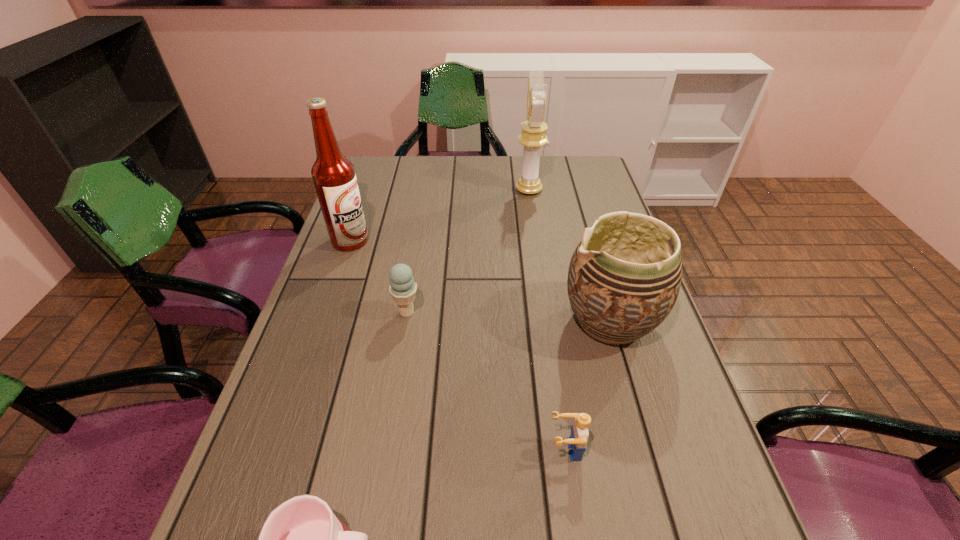
The width and height of the screenshot is (960, 540). What are the coordinates of `alcohol` in the screenshot? It's located at (334, 177).

Where is `award`? This screenshot has width=960, height=540. award is located at coordinates (533, 137).

You are a GUI agent. You are given a task and a screenshot of the screen. Output one action in this format:
    pyautogui.click(x=<x>, y=<y>)
    Task: Click on the fourth shortest object
    Image resolution: width=960 pixels, height=540 pixels.
    Given the screenshot: What is the action you would take?
    pyautogui.click(x=622, y=283)

Identify the location of the fourth tallest object. Image resolution: width=960 pixels, height=540 pixels. [402, 288].

The width and height of the screenshot is (960, 540). Find the location of `Lego`. Lego is located at coordinates (579, 434).

At what (x,y) coordinates should I click in order to perform the action: click on the fifth farthest object. Please return your answer as a coordinate pair (x, y). This screenshot has height=540, width=960. Looking at the image, I should click on (579, 434).

The width and height of the screenshot is (960, 540). I want to click on vacant space located 0.320m on the label side of the alcohol, so click(x=480, y=241).

Find the location of `blank space located 0.340m on the front-facing side of the award`. blank space located 0.340m on the front-facing side of the award is located at coordinates (414, 190).

Locate an element on the screen. Image resolution: width=960 pixels, height=540 pixels. vacant space located on the front-facing side of the award is located at coordinates (398, 190).

The width and height of the screenshot is (960, 540). I want to click on free space located on the front-facing side of the award, so click(x=401, y=190).